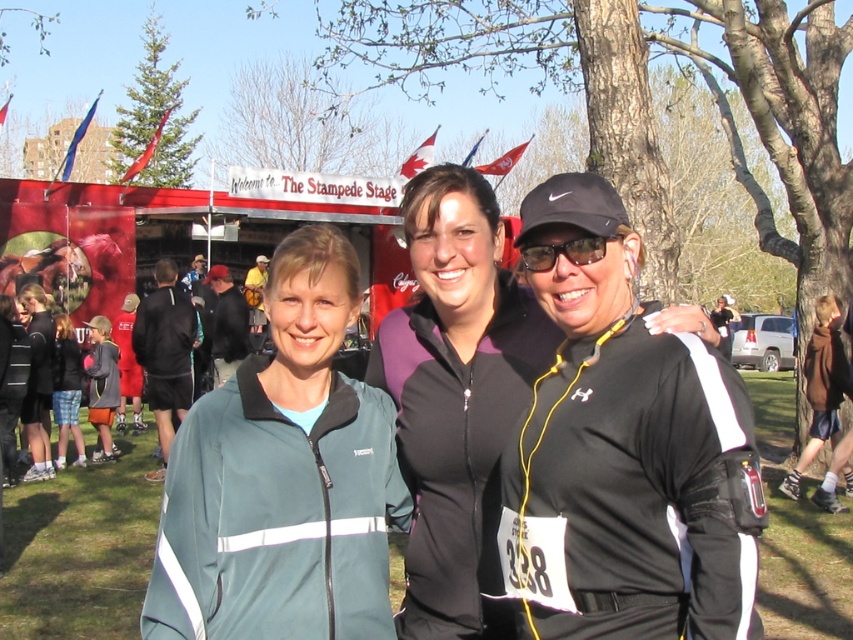
Question: Is the position of dark gray jacket at left more distant than that of green fabric jacket at left?

Choices:
 (A) no
 (B) yes

Answer: (B)

Question: Which object is the farthest from the dark gray hoodie at center?

Choices:
 (A) green fabric jacket at center
 (B) dark gray jacket at left
 (C) black matte sunglasses at center
 (D) black matte jacket at center

Answer: (D)

Question: Where is green fabric jacket at center located in relation to plaid skirt at lower left in the image?

Choices:
 (A) above
 (B) below

Answer: (A)

Question: Which point is farther to the camera?

Choices:
 (A) green fabric jacket at center
 (B) black matte jacket at center
 (C) dark gray jacket at center
 (D) dark gray jacket at left

Answer: (C)

Question: Which object is farther from the camera taking this photo?

Choices:
 (A) green fabric jacket at left
 (B) green fabric jacket at center
 (C) dark gray jacket at center
 (D) dark gray jacket at left

Answer: (C)

Question: Is dark gray jacket at left positioned at the back of green fabric jacket at left?

Choices:
 (A) no
 (B) yes

Answer: (B)